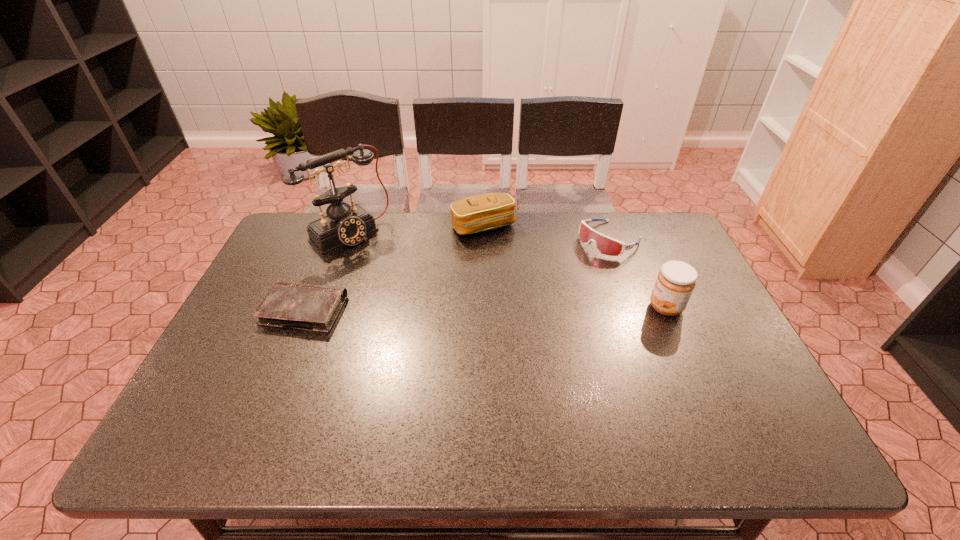
The height and width of the screenshot is (540, 960). In order to click on vacant region that satisfies the following two spatial constraints: 1. on the front side of the second shortest object; 2. on the left side of the tallest object in this screenshot , I will do `click(347, 239)`.

At what (x,y) coordinates should I click in order to perform the action: click on vacant position in the image that satisfies the following two spatial constraints: 1. on the front side of the goggles; 2. on the front label of the fourth shortest object. Please return your answer as a coordinate pair (x, y). This screenshot has height=540, width=960. Looking at the image, I should click on (635, 307).

Identify the location of free region that satisfies the following two spatial constraints: 1. on the front side of the second tallest object; 2. on the front label of the goggles. This screenshot has height=540, width=960. (635, 307).

I want to click on vacant point that satisfies the following two spatial constraints: 1. on the front side of the tallest object; 2. on the front label of the jam, so click(x=321, y=307).

The height and width of the screenshot is (540, 960). What are the coordinates of `vacant area in the image that satisfies the following two spatial constraints: 1. on the back side of the goggles; 2. on the left side of the shortest object` in the screenshot? It's located at (333, 239).

The width and height of the screenshot is (960, 540). In order to click on free spot that satisfies the following two spatial constraints: 1. on the back side of the third shortest object; 2. on the left side of the tallest object in this screenshot , I will do `click(351, 227)`.